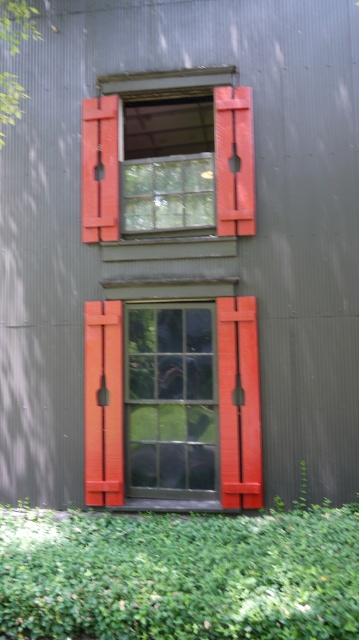
Question: Is green leafy hedge at lower center to the left of matte glass window at center from the viewer's perspective?

Choices:
 (A) yes
 (B) no

Answer: (B)

Question: Which point appears closest to the camera in this image?

Choices:
 (A) (193, 605)
 (B) (184, 472)

Answer: (A)

Question: Which object is farther from the camera taking this photo?

Choices:
 (A) green leafy hedge at lower center
 (B) matte glass window at center

Answer: (B)

Question: Can you confirm if green leafy hedge at lower center is bigger than matte glass window at center?

Choices:
 (A) no
 (B) yes

Answer: (B)

Question: Can you confirm if green leafy hedge at lower center is positioned above matte glass window at center?

Choices:
 (A) no
 (B) yes

Answer: (A)